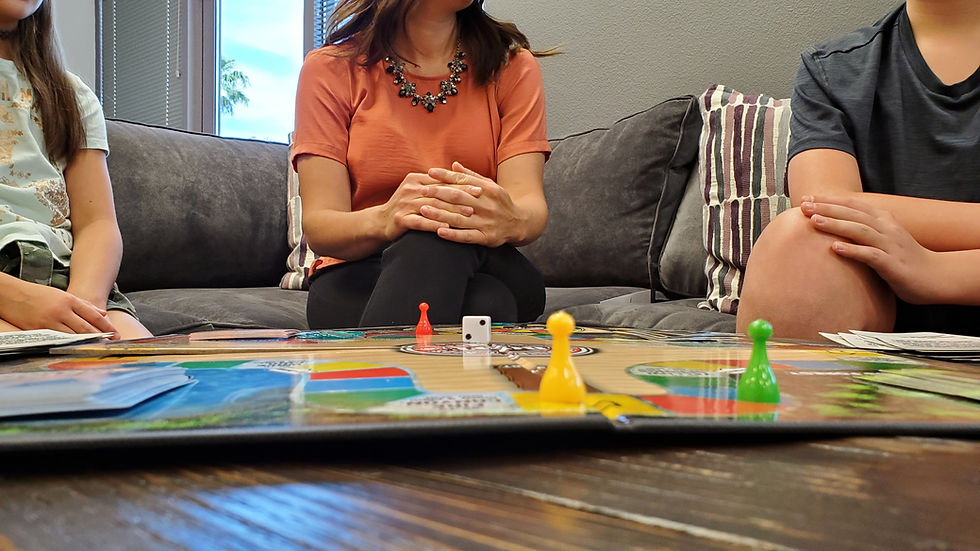
Locate an element on the screen. The width and height of the screenshot is (980, 551). sofa is located at coordinates (179, 199).